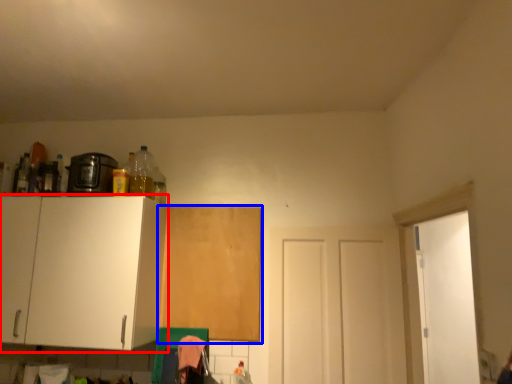
Question: Which object is closer to the camera taking this photo, cabinetry (highlighted by a red box) or cabinetry (highlighted by a blue box)?

Choices:
 (A) cabinetry
 (B) cabinetry

Answer: (A)